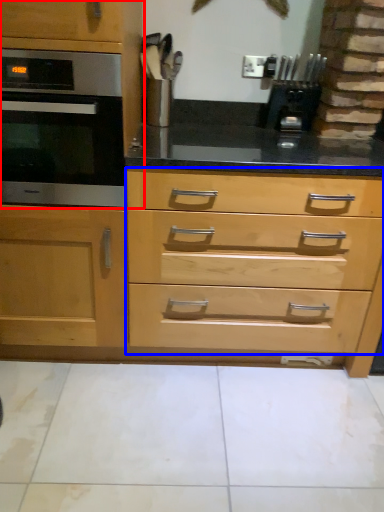
Question: Which object appears farthest to the camera in this image, cabinetry (highlighted by a red box) or drawer (highlighted by a blue box)?

Choices:
 (A) cabinetry
 (B) drawer

Answer: (B)